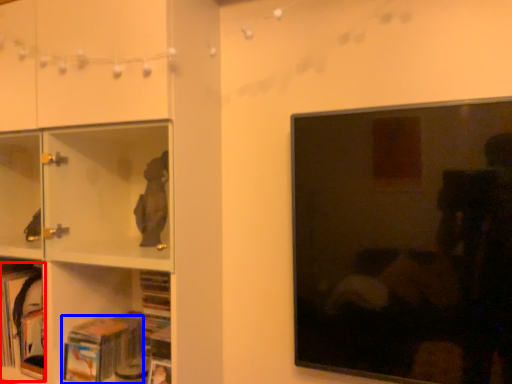
Question: Among these objects, which one is farthest to the camera, book (highlighted by a red box) or book (highlighted by a blue box)?

Choices:
 (A) book
 (B) book

Answer: (A)